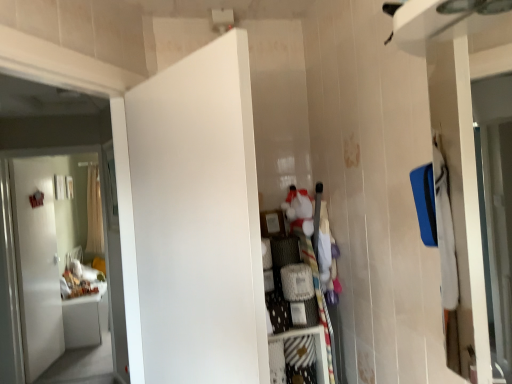
Question: Does white fabric dresser at center lie in front of white matte door at center, which is counted as the second door, starting from the left?

Choices:
 (A) no
 (B) yes

Answer: (A)

Question: Is the depth of white fabric dresser at center greater than that of white matte door at center, acting as the 1th door starting from the front?

Choices:
 (A) yes
 (B) no

Answer: (A)

Question: Is white fabric dresser at center positioned far away from white matte door at center, positioned as the first door in right-to-left order?

Choices:
 (A) yes
 (B) no

Answer: (B)

Question: Can you confirm if white fabric dresser at center is taller than white matte door at center, the second door viewed from the back?

Choices:
 (A) no
 (B) yes

Answer: (A)

Question: From the image's perspective, is white fabric dresser at center located beneath white matte door at center, the second door viewed from the back?

Choices:
 (A) no
 (B) yes

Answer: (B)

Question: From a real-world perspective, relative to white fabric dresser at center, is white sheer curtain at left vertically above or below?

Choices:
 (A) below
 (B) above

Answer: (B)

Question: From the image's perspective, is white sheer curtain at left located above or below white fabric dresser at center?

Choices:
 (A) below
 (B) above

Answer: (B)

Question: Looking at the image, does white sheer curtain at left seem bigger or smaller compared to white fabric dresser at center?

Choices:
 (A) big
 (B) small

Answer: (A)

Question: In the image, is white sheer curtain at left positioned in front of or behind white fabric dresser at center?

Choices:
 (A) behind
 (B) front

Answer: (A)

Question: Is white sheer curtain at left taller or shorter than white matte door at center, positioned as the first door in right-to-left order?

Choices:
 (A) tall
 (B) short

Answer: (A)

Question: From a real-world perspective, relative to white matte door at center, which is counted as the second door, starting from the left, is white sheer curtain at left vertically above or below?

Choices:
 (A) below
 (B) above

Answer: (B)

Question: Is white sheer curtain at left in front of or behind white matte door at center, which is counted as the second door, starting from the left, in the image?

Choices:
 (A) behind
 (B) front

Answer: (A)

Question: Considering the relative positions of white sheer curtain at left and white matte door at center, acting as the 1th door starting from the front, in the image provided, is white sheer curtain at left to the left or to the right of white matte door at center, acting as the 1th door starting from the front,?

Choices:
 (A) right
 (B) left

Answer: (B)

Question: From the image's perspective, is white matte door at left, marked as the 2th door in a front-to-back arrangement, located above or below white fabric dresser at center?

Choices:
 (A) above
 (B) below

Answer: (B)

Question: Considering the positions of white matte door at left, marked as the 2th door in a front-to-back arrangement, and white fabric dresser at center in the image, is white matte door at left, marked as the 2th door in a front-to-back arrangement, taller or shorter than white fabric dresser at center?

Choices:
 (A) tall
 (B) short

Answer: (A)